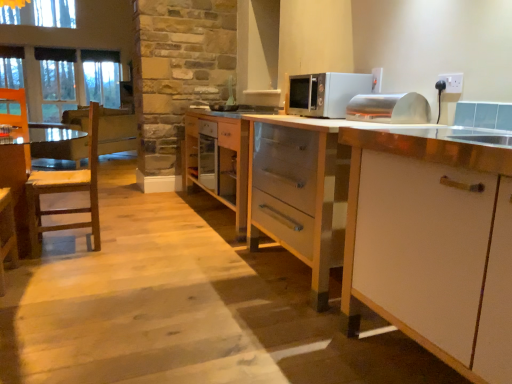
What are the coordinates of `satin silver toaster at upper right` in the screenshot? It's located at (389, 108).

This screenshot has height=384, width=512. Describe the element at coordinates (76, 79) in the screenshot. I see `clear glass window at upper left` at that location.

The height and width of the screenshot is (384, 512). Describe the element at coordinates (218, 160) in the screenshot. I see `wooden cabinet at center, placed as the 1th cabinetry when sorted from back to front` at that location.

In order to face white plastic electric outlet at upper right, should I rotate leftwards or rightwards?

It's best to rotate right around 24.244 degrees.

In order to face white glossy counter top at center, should I rotate leftwards or rightwards?

A 17.843 degree turn to the left will do.

Image resolution: width=512 pixels, height=384 pixels. I want to click on satin silver toaster at upper right, so click(389, 108).

Considering the relative sizes of wooden cabinet at center, placed as the 1th cabinetry when sorted from back to front, and satin silver microwave at upper center in the image provided, is wooden cabinet at center, placed as the 1th cabinetry when sorted from back to front, thinner than satin silver microwave at upper center?

Incorrect, the width of wooden cabinet at center, placed as the 1th cabinetry when sorted from back to front, is not less than that of satin silver microwave at upper center.

Is wooden cabinet at center, placed as the third cabinetry when sorted from front to back, surrounding satin silver microwave at upper center?

No.

Could you tell me if wooden cabinet at center, placed as the third cabinetry when sorted from front to back, is facing satin silver microwave at upper center?

No, wooden cabinet at center, placed as the third cabinetry when sorted from front to back, is not facing towards satin silver microwave at upper center.

From a real-world perspective, is wooden cabinet at center, placed as the 1th cabinetry when sorted from back to front, under satin silver microwave at upper center?

Correct, in the physical world, wooden cabinet at center, placed as the 1th cabinetry when sorted from back to front, is lower than satin silver microwave at upper center.

Consider the image. Could you tell me if wooden cabinet at center, placed as the third cabinetry when sorted from front to back, is turned towards white plastic electric outlet at upper right?

No, wooden cabinet at center, placed as the third cabinetry when sorted from front to back, does not turn towards white plastic electric outlet at upper right.

Which is behind, wooden cabinet at center, placed as the 1th cabinetry when sorted from back to front, or white plastic electric outlet at upper right?

wooden cabinet at center, placed as the 1th cabinetry when sorted from back to front, is further away from the camera.

Which of these two, wooden cabinet at center, placed as the third cabinetry when sorted from front to back, or white plastic electric outlet at upper right, is wider?

With larger width is wooden cabinet at center, placed as the third cabinetry when sorted from front to back.

Is white glossy counter top at center a part of white matte cabinet at center, placed as the 2th cabinetry when sorted from back to front?

Actually, white glossy counter top at center is outside white matte cabinet at center, placed as the 2th cabinetry when sorted from back to front.

Can you confirm if white matte cabinet at center, placed as the 2th cabinetry when sorted from back to front, is thinner than white glossy counter top at center?

Indeed, white matte cabinet at center, placed as the 2th cabinetry when sorted from back to front, has a lesser width compared to white glossy counter top at center.

How much distance is there between white matte cabinet at center, placed as the 2th cabinetry when sorted from back to front, and white glossy counter top at center?

A distance of 17.41 inches exists between white matte cabinet at center, placed as the 2th cabinetry when sorted from back to front, and white glossy counter top at center.

Considering the sizes of objects clear glass window at upper left and wooden cabinet at center, placed as the 1th cabinetry when sorted from back to front, in the image provided, who is wider, clear glass window at upper left or wooden cabinet at center, placed as the 1th cabinetry when sorted from back to front,?

With larger width is wooden cabinet at center, placed as the 1th cabinetry when sorted from back to front.

Is clear glass window at upper left situated inside wooden cabinet at center, placed as the third cabinetry when sorted from front to back, or outside?

The correct answer is: outside.

Visually, is clear glass window at upper left positioned to the left or to the right of wooden cabinet at center, placed as the third cabinetry when sorted from front to back?

In the image, clear glass window at upper left appears on the left side of wooden cabinet at center, placed as the third cabinetry when sorted from front to back.

What's the angular difference between clear glass window at upper left and wooden cabinet at center, placed as the 1th cabinetry when sorted from back to front,'s facing directions?

They differ by 87.2 degrees in their facing directions.

Is white matte cabinet at right, which ranks as the 1th cabinetry in front-to-back order, placed right next to satin silver microwave at upper center?

There is a gap between white matte cabinet at right, which ranks as the 1th cabinetry in front-to-back order, and satin silver microwave at upper center.

Who is bigger, white matte cabinet at right, which appears as the third cabinetry when viewed from the back, or satin silver microwave at upper center?

With larger size is white matte cabinet at right, which appears as the third cabinetry when viewed from the back.

Which is behind, point (445, 240) or point (288, 102)?

Positioned behind is point (288, 102).

Is white matte cabinet at right, which ranks as the 1th cabinetry in front-to-back order, thinner than satin silver microwave at upper center?

In fact, white matte cabinet at right, which ranks as the 1th cabinetry in front-to-back order, might be wider than satin silver microwave at upper center.

Is white matte cabinet at right, which appears as the third cabinetry when viewed from the back, wider than clear glass window at upper left?

Indeed, white matte cabinet at right, which appears as the third cabinetry when viewed from the back, has a greater width compared to clear glass window at upper left.

From a real-world perspective, relative to clear glass window at upper left, is white matte cabinet at right, which appears as the third cabinetry when viewed from the back, vertically above or below?

white matte cabinet at right, which appears as the third cabinetry when viewed from the back, is below clear glass window at upper left.

From the image's perspective, is white matte cabinet at right, which ranks as the 1th cabinetry in front-to-back order, above or below clear glass window at upper left?

Based on their image positions, white matte cabinet at right, which ranks as the 1th cabinetry in front-to-back order, is located beneath clear glass window at upper left.

Is white matte cabinet at right, which appears as the third cabinetry when viewed from the back, at the left side of clear glass window at upper left?

No, white matte cabinet at right, which appears as the third cabinetry when viewed from the back, is not to the left of clear glass window at upper left.

Is white wood drawer at center far from wooden cabinet at center, placed as the 1th cabinetry when sorted from back to front?

No, white wood drawer at center is not far away from wooden cabinet at center, placed as the 1th cabinetry when sorted from back to front.

From the image's perspective, does white wood drawer at center appear lower than wooden cabinet at center, placed as the third cabinetry when sorted from front to back?

Actually, white wood drawer at center appears above wooden cabinet at center, placed as the third cabinetry when sorted from front to back, in the image.

Identify the location of drawer behind the wooden cabinet at center, placed as the third cabinetry when sorted from front to back. This screenshot has height=384, width=512. (213, 155).

Is wooden cabinet at center, placed as the 1th cabinetry when sorted from back to front, at the back of white wood drawer at center?

Yes, wooden cabinet at center, placed as the 1th cabinetry when sorted from back to front, is at the back of white wood drawer at center.

This screenshot has height=384, width=512. I want to click on microwave oven above the wooden cabinet at center, placed as the 1th cabinetry when sorted from back to front (from the image's perspective), so click(x=325, y=93).

From the image's perspective, count 1st cabinetrys downward from the white plastic electric outlet at upper right and point to it. Please provide its 2D coordinates.

[(218, 160)]

Based on their spatial positions, is clear glass window at upper left or white matte cabinet at center, placed as the 2th cabinetry when sorted from back to front, further from white glossy counter top at center?

clear glass window at upper left is further to white glossy counter top at center.

Considering their positions, is wooden cabinet at center, placed as the 1th cabinetry when sorted from back to front, positioned closer to clear glass window at upper left than white glossy counter top at center?

Among the two, wooden cabinet at center, placed as the 1th cabinetry when sorted from back to front, is located nearer to clear glass window at upper left.

From the image, which object appears to be nearer to clear glass window at upper left, wooden chair at left or white glossy counter top at center?

wooden chair at left is positioned closer to the anchor clear glass window at upper left.

Considering their positions, is wooden cabinet at center, placed as the third cabinetry when sorted from front to back, positioned closer to satin silver toaster at upper right than white wood drawer at center?

wooden cabinet at center, placed as the third cabinetry when sorted from front to back.

Looking at the image, which one is located closer to white wood drawer at center, white glossy counter top at center or clear glass window at upper left?

Among the two, clear glass window at upper left is located nearer to white wood drawer at center.

Looking at the image, which one is located closer to clear glass window at upper left, white matte cabinet at center, which ranks as the 2th cabinetry in front-to-back order, or wooden cabinet at center, placed as the third cabinetry when sorted from front to back?

wooden cabinet at center, placed as the third cabinetry when sorted from front to back, lies closer to clear glass window at upper left than the other object.

Estimate the real-world distances between objects in this image. Which object is further from satin silver toaster at upper right, white glossy counter top at center or white wood drawer at center?

The object further to satin silver toaster at upper right is white wood drawer at center.

When comparing their distances from wooden cabinet at center, placed as the third cabinetry when sorted from front to back, does white plastic electric outlet at upper right or satin silver microwave at upper center seem further?

The object further to wooden cabinet at center, placed as the third cabinetry when sorted from front to back, is white plastic electric outlet at upper right.

You are a GUI agent. You are given a task and a screenshot of the screen. Output one action in this format:
    pyautogui.click(x=<x>, y=<y>)
    Task: Click on the cabinetry positioned between wooden chair at left and clear glass window at upper left from near to far
    
    Given the screenshot: What is the action you would take?
    pyautogui.click(x=218, y=160)

At what (x,y) coordinates should I click in order to perform the action: click on electric outlet between white matte cabinet at right, which ranks as the 1th cabinetry in front-to-back order, and satin silver microwave at upper center, along the z-axis. Please return your answer as a coordinate pair (x, y). Image resolution: width=512 pixels, height=384 pixels. Looking at the image, I should click on (452, 82).

Identify the location of microwave oven situated between white glossy counter top at center and white plastic electric outlet at upper right from left to right. This screenshot has height=384, width=512. coord(325,93).

Identify the location of microwave oven between wooden cabinet at center, placed as the 1th cabinetry when sorted from back to front, and white plastic electric outlet at upper right. This screenshot has width=512, height=384. (325, 93).